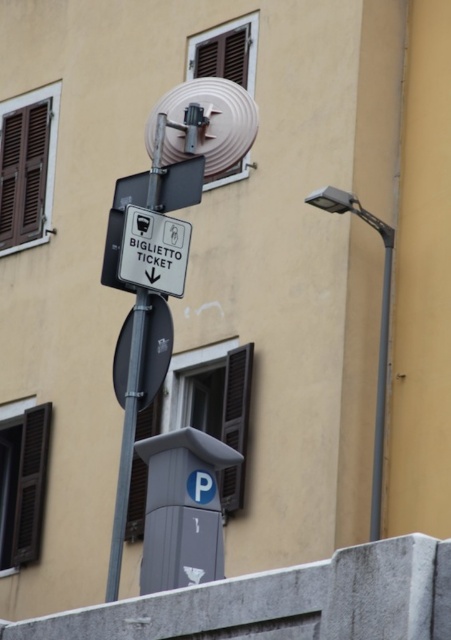
You are a delivery driver who needs to park your van. You see the gray plastic parking sign at lower center and the metallic pole at center. Which object is narrower so you can park without hitting it?

The gray plastic parking sign at lower center is thinner than the metallic pole at center, so you should avoid hitting the narrower gray plastic parking sign at lower center when parking.

You are standing on the sidewalk and see the metallic pole at center and the gray plastic parking sign at lower center. Which object is closer to you?

The gray plastic parking sign at lower center is closer to you because the metallic pole at center is behind it.

You are a pedestrian standing in front of the beige building with two windows. You see a metallic pole at center and a gray plastic parking sign at lower center. Which object is closer to the ground?

The gray plastic parking sign at lower center is closer to the ground because it is located below the metallic pole at center.